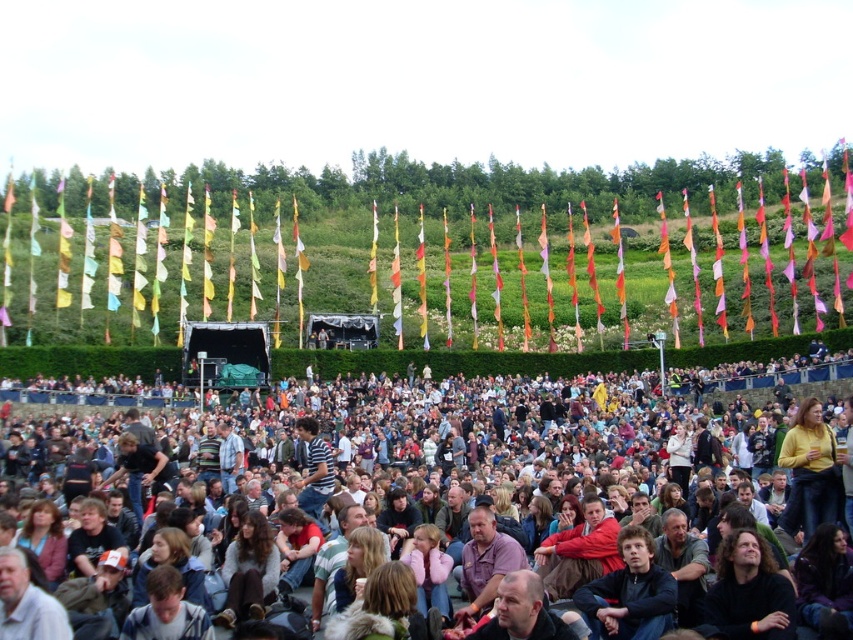
You are a photographer at the concert and want to capture the multicolored fabric crowd at center. Where should you position your camera to ensure they are in the frame?

The multicolored fabric crowd at center is located at coordinates point (x=451, y=468), so position the camera there to capture them in the frame.

You are a photographer trying to capture the multicolored fabric crowd at center and the dark blue sweater at center in the same frame. Your camera has a maximum focus range of 35 meters. Can you fit both subjects in the frame without moving?

The multicolored fabric crowd at center and the dark blue sweater at center are 36.16 meters apart. Since the distance exceeds the camera maximum focus range of 35 meters, you cannot fit both subjects in the frame without moving.

From the picture: You are a photographer at the concert and want to capture a clear shot of the dark blue sweater at center without the multicolored fabric crowd at center blocking it. How can you adjust your position to achieve this?

The multicolored fabric crowd at center is much taller than the dark blue sweater at center. To avoid the crowd blocking the view, you should position yourself higher, such as standing on a raised platform or using a taller tripod to look over the crowd.